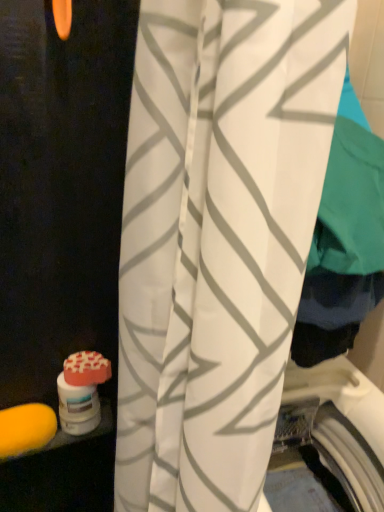
Question: Can you confirm if orange matte soap at lower left, which is the second soap in left-to-right order, is thinner than white fabric curtain at center?

Choices:
 (A) yes
 (B) no

Answer: (A)

Question: Is orange matte soap at lower left, the 2th soap from the bottom, completely or partially outside of white fabric curtain at center?

Choices:
 (A) no
 (B) yes

Answer: (B)

Question: Does orange matte soap at lower left, which is the second soap in left-to-right order, have a greater width compared to white fabric curtain at center?

Choices:
 (A) yes
 (B) no

Answer: (B)

Question: Could you tell me if orange matte soap at lower left, arranged as the first soap when viewed from the right, is turned towards white fabric curtain at center?

Choices:
 (A) no
 (B) yes

Answer: (B)

Question: Can you confirm if orange matte soap at lower left, the 2th soap from the bottom, is smaller than white fabric curtain at center?

Choices:
 (A) yes
 (B) no

Answer: (A)

Question: Is orange matte soap at lower left, the 2th soap from the bottom, positioned behind white fabric curtain at center?

Choices:
 (A) yes
 (B) no

Answer: (A)

Question: Could you tell me if white fabric curtain at center is facing orange matte soap at lower left, which appears as the 1th soap when viewed from the top?

Choices:
 (A) no
 (B) yes

Answer: (A)

Question: Considering the relative sizes of white fabric curtain at center and orange matte soap at lower left, which appears as the 1th soap when viewed from the top, in the image provided, is white fabric curtain at center taller than orange matte soap at lower left, which appears as the 1th soap when viewed from the top,?

Choices:
 (A) yes
 (B) no

Answer: (A)

Question: Is white fabric curtain at center surrounding orange matte soap at lower left, which is the second soap in left-to-right order?

Choices:
 (A) yes
 (B) no

Answer: (B)

Question: Does white fabric curtain at center have a smaller size compared to orange matte soap at lower left, which is the second soap in left-to-right order?

Choices:
 (A) yes
 (B) no

Answer: (B)

Question: Is white fabric curtain at center with orange matte soap at lower left, the 2th soap from the bottom?

Choices:
 (A) yes
 (B) no

Answer: (B)

Question: Is white fabric curtain at center at the left side of orange matte soap at lower left, the 2th soap from the bottom?

Choices:
 (A) yes
 (B) no

Answer: (B)

Question: Is yellow sponge at lower left, the 1th soap in the left-to-right sequence, outside of orange matte soap at lower left, the 2th soap from the bottom?

Choices:
 (A) no
 (B) yes

Answer: (B)